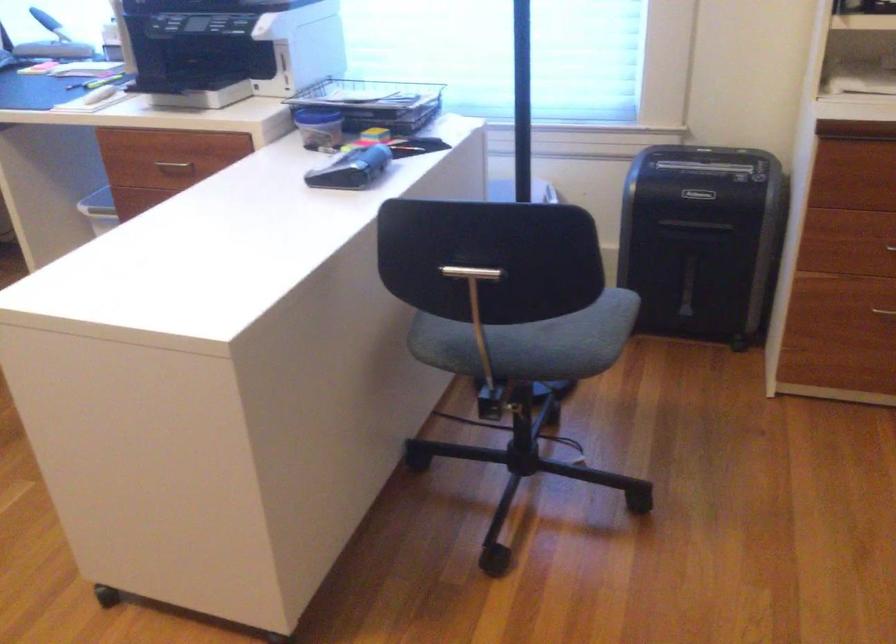
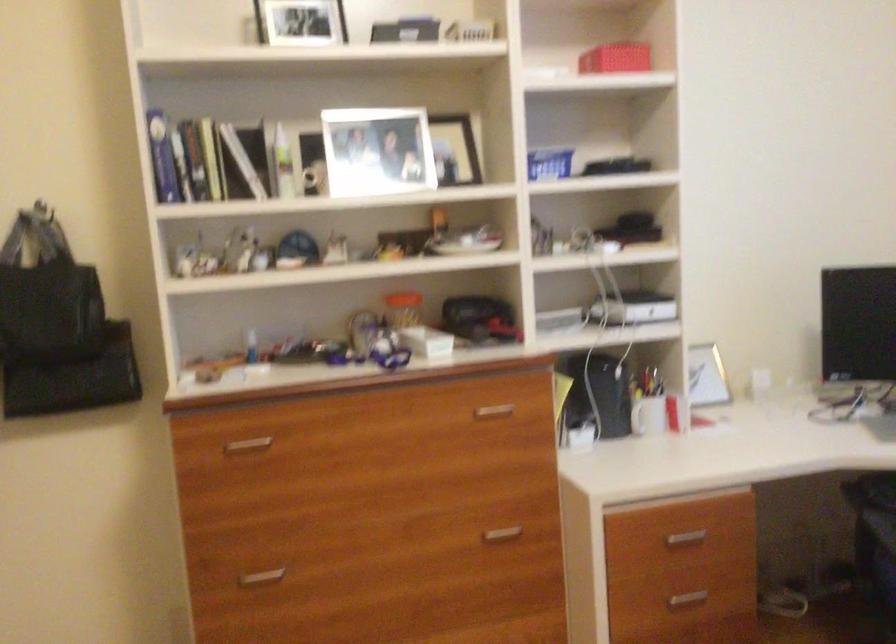
Question: The first image is from the beginning of the video and the second image is from the end. How did the camera likely rotate when shooting the video?

Choices:
 (A) Left
 (B) Right
 (C) Up
 (D) Down

Answer: (A)